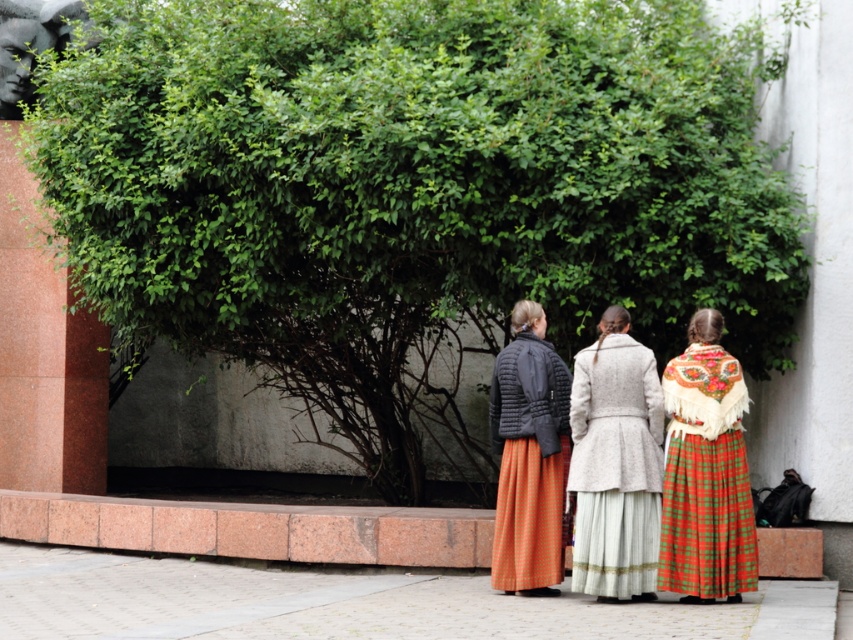
Question: Among these objects, which one is nearest to the camera?

Choices:
 (A) brushed metal sculpture at upper left
 (B) plaid wool skirt at center

Answer: (B)

Question: Does light gray wool coat at center have a smaller size compared to brushed metal sculpture at upper left?

Choices:
 (A) yes
 (B) no

Answer: (A)

Question: Which object is positioned closest to the red granite pillar at left?

Choices:
 (A) brushed metal sculpture at upper left
 (B) matte black jacket at center

Answer: (A)

Question: Which of these objects is positioned closest to the matte black jacket at center?

Choices:
 (A) brushed metal sculpture at upper left
 (B) red granite pillar at left

Answer: (B)

Question: Can you confirm if plaid wool skirt at center is smaller than brushed metal sculpture at upper left?

Choices:
 (A) no
 (B) yes

Answer: (B)

Question: Does red granite pillar at left have a lesser width compared to light gray wool coat at center?

Choices:
 (A) yes
 (B) no

Answer: (B)